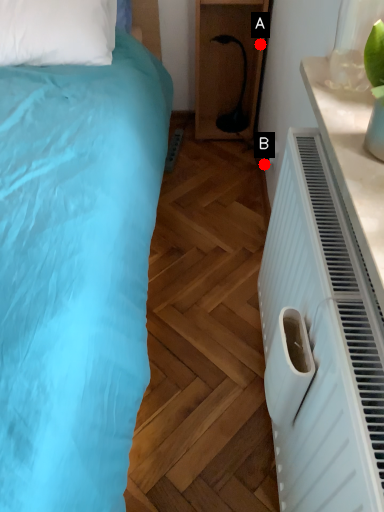
Question: Two points are circled on the image, labeled by A and B beside each circle. Among these points, which one is nearest to the camera?

Choices:
 (A) A is closer
 (B) B is closer

Answer: (A)